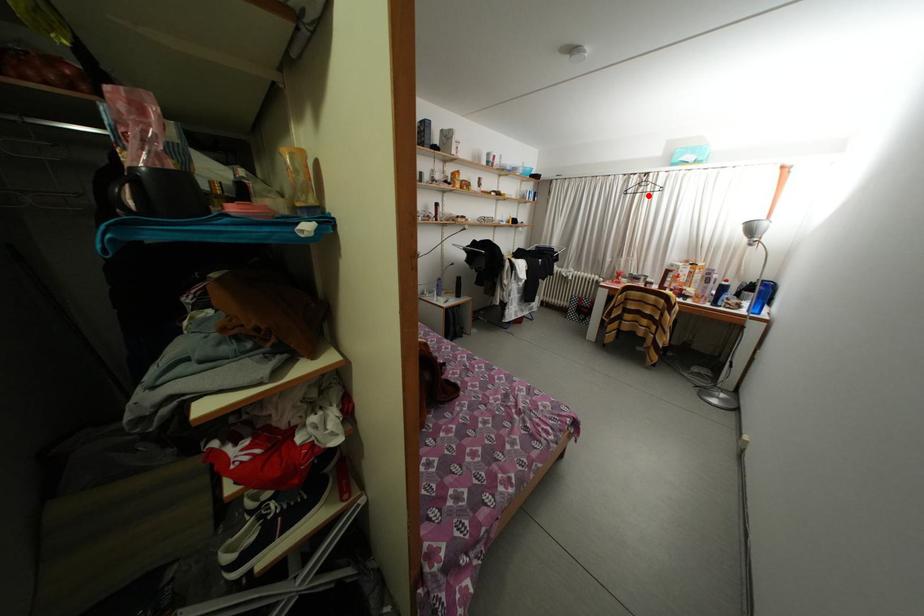
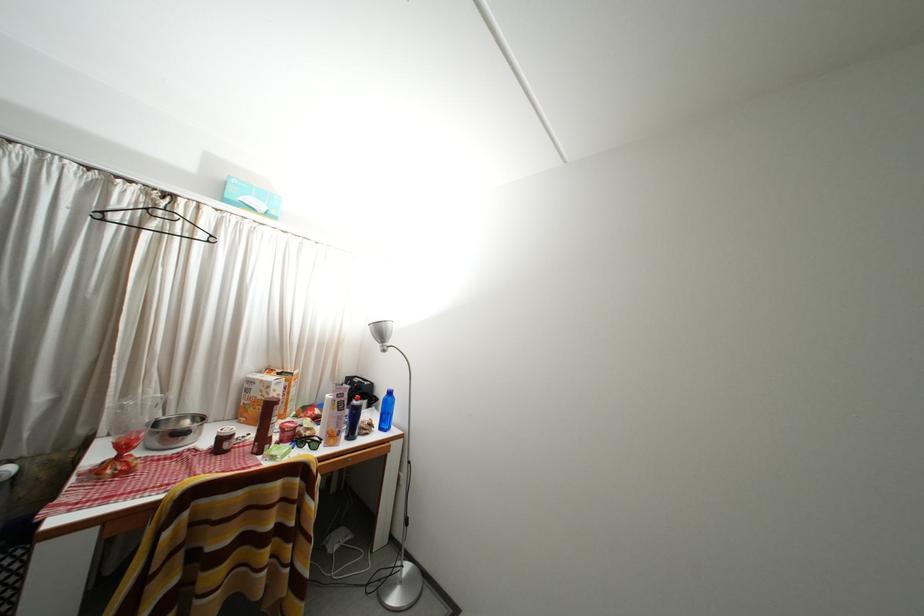
Locate, in the second image, the point that corresponds to the highlighted location in the first image.

(161, 230)